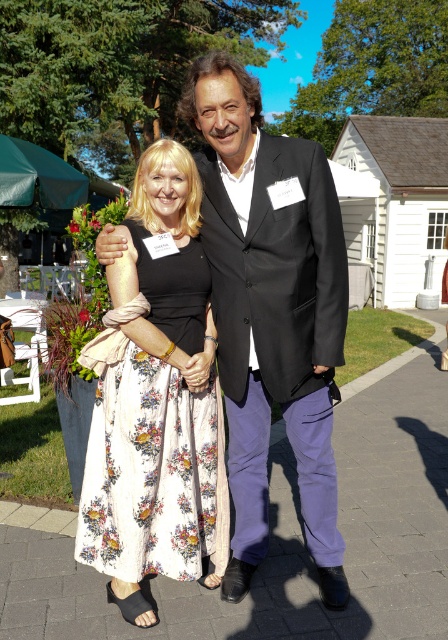
Question: Which of the following is the closest to the observer?

Choices:
 (A) (366, 465)
 (B) (337, 588)
 (C) (124, 413)

Answer: (C)

Question: Among these points, which one is nearest to the camera?

Choices:
 (A) (202, 525)
 (B) (367, 524)
 (C) (255, 563)

Answer: (A)

Question: Is white concrete pavement at center positioned in front of black satin suit at center?

Choices:
 (A) no
 (B) yes

Answer: (A)

Question: Does white concrete pavement at center appear on the left side of black satin suit at center?

Choices:
 (A) yes
 (B) no

Answer: (B)

Question: Which of the following is the closest to the observer?

Choices:
 (A) (232, 360)
 (B) (373, 472)

Answer: (A)

Question: Does black satin suit at center appear over floral cotton dress at center?

Choices:
 (A) yes
 (B) no

Answer: (A)